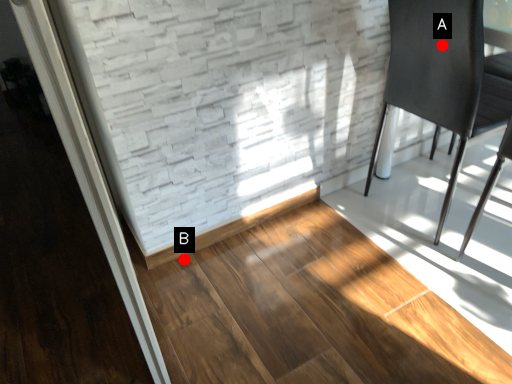
Question: Two points are circled on the image, labeled by A and B beside each circle. Which of the following is the farthest from the observer?

Choices:
 (A) A is further
 (B) B is further

Answer: (B)